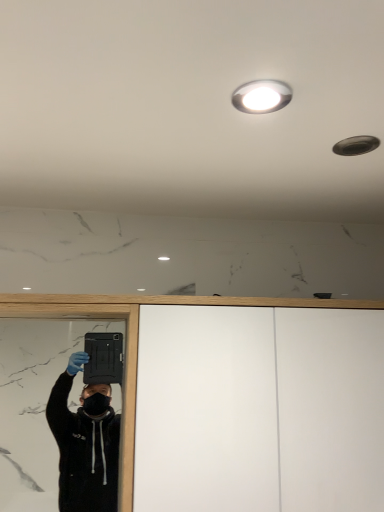
Question: Is white matte dresser at center bigger than white glossy droplight at upper center?

Choices:
 (A) no
 (B) yes

Answer: (B)

Question: Is white matte dresser at center beside white glossy droplight at upper center?

Choices:
 (A) yes
 (B) no

Answer: (B)

Question: Can you confirm if white matte dresser at center is smaller than white glossy droplight at upper center?

Choices:
 (A) no
 (B) yes

Answer: (A)

Question: Considering the relative positions of white matte dresser at center and white glossy droplight at upper center in the image provided, is white matte dresser at center to the left of white glossy droplight at upper center from the viewer's perspective?

Choices:
 (A) no
 (B) yes

Answer: (A)

Question: Considering the relative sizes of white matte dresser at center and white glossy droplight at upper center in the image provided, is white matte dresser at center taller than white glossy droplight at upper center?

Choices:
 (A) yes
 (B) no

Answer: (A)

Question: Is white matte dresser at center outside white glossy droplight at upper center?

Choices:
 (A) yes
 (B) no

Answer: (A)

Question: From a real-world perspective, does white glossy droplight at upper center sit lower than white matte dresser at center?

Choices:
 (A) no
 (B) yes

Answer: (A)

Question: Are white glossy droplight at upper center and white matte dresser at center far apart?

Choices:
 (A) yes
 (B) no

Answer: (B)

Question: Does white glossy droplight at upper center lie in front of white matte dresser at center?

Choices:
 (A) no
 (B) yes

Answer: (B)

Question: From the image's perspective, is white glossy droplight at upper center above white matte dresser at center?

Choices:
 (A) yes
 (B) no

Answer: (A)

Question: Is white glossy droplight at upper center turned away from white matte dresser at center?

Choices:
 (A) no
 (B) yes

Answer: (A)

Question: Does white glossy droplight at upper center have a greater width compared to white matte dresser at center?

Choices:
 (A) no
 (B) yes

Answer: (A)

Question: Is white matte dresser at center spatially inside white glossy droplight at upper center, or outside of it?

Choices:
 (A) inside
 (B) outside

Answer: (B)